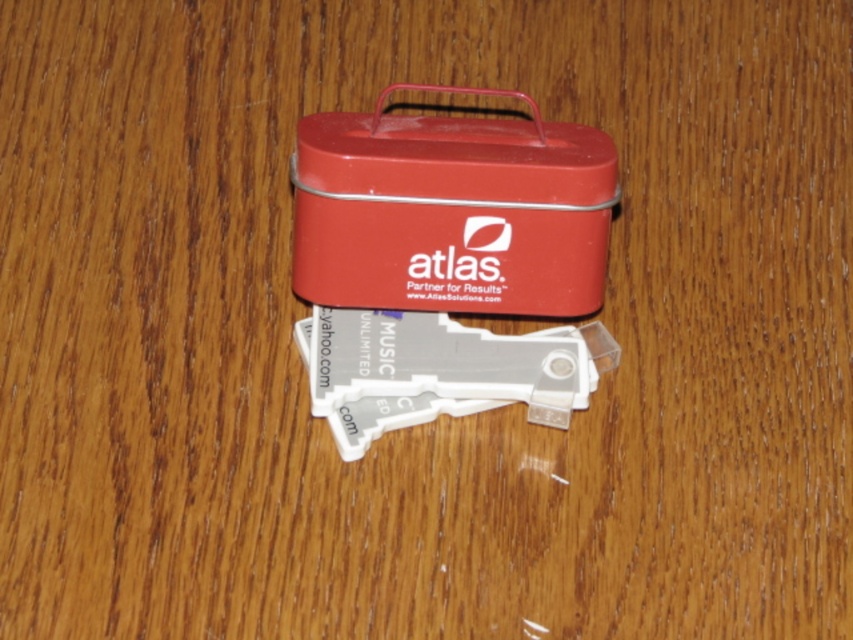
Is matte red tin at center above transparent plastic keychain at center?

Yes.

Does point (572, 256) lie behind point (380, 417)?

That is False.

Find the location of a particular element. This screenshot has height=640, width=853. matte red tin at center is located at coordinates (451, 211).